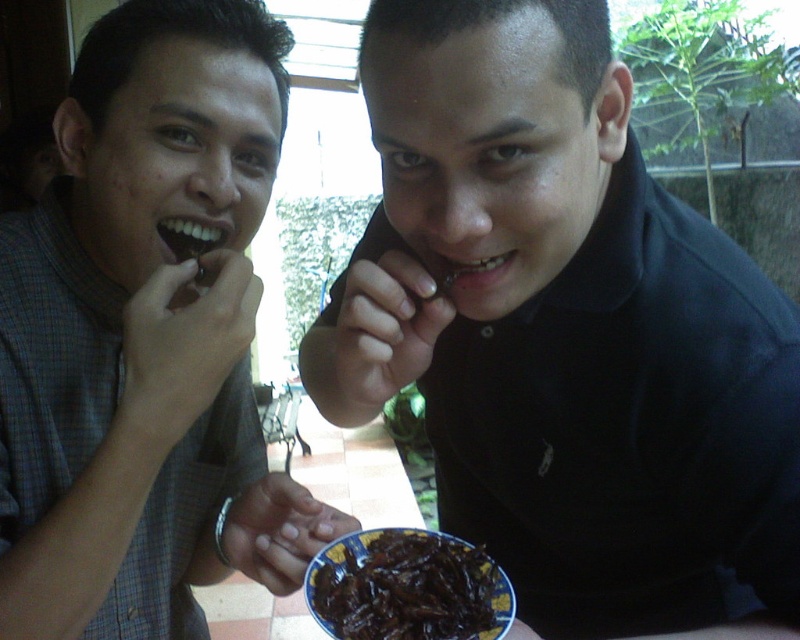
Who is shorter, black matte shirt at center or dark glossy insects at center?

Standing shorter between the two is dark glossy insects at center.

Between point (704, 572) and point (324, 589), which one is positioned behind?

The point (704, 572) is more distant.

Identify the location of black matte shirt at center. (564, 328).

Is black matte shirt at center thinner than matte black shirt at left?

No, black matte shirt at center is not thinner than matte black shirt at left.

Image resolution: width=800 pixels, height=640 pixels. What do you see at coordinates (564, 328) in the screenshot?
I see `black matte shirt at center` at bounding box center [564, 328].

Where is `black matte shirt at center`? The width and height of the screenshot is (800, 640). black matte shirt at center is located at coordinates (564, 328).

Which is in front, point (74, 218) or point (354, 592)?

Point (354, 592)

Does matte black shirt at left appear on the left side of dark glossy insects at center?

Correct, you'll find matte black shirt at left to the left of dark glossy insects at center.

Where is `matte black shirt at left`? matte black shirt at left is located at coordinates (145, 337).